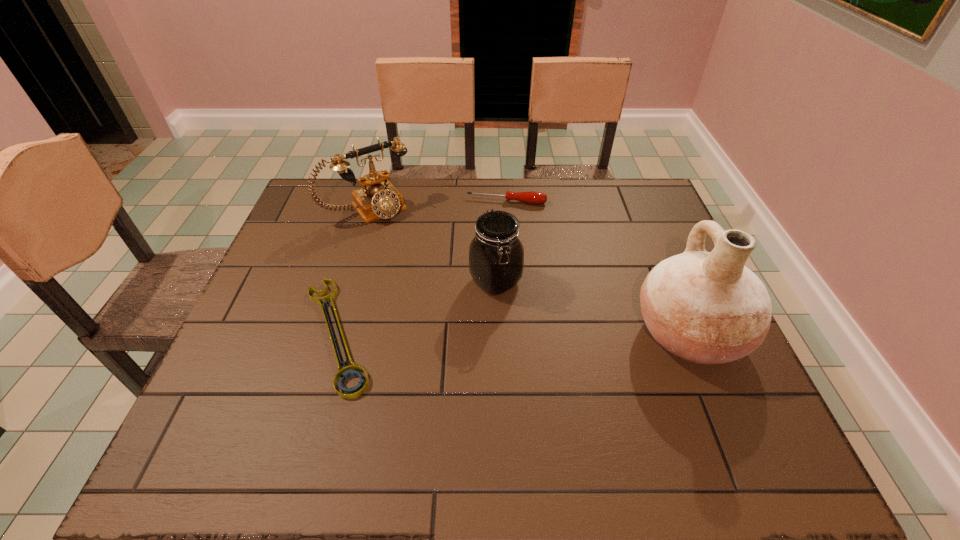
Find the location of a particular element. The height and width of the screenshot is (540, 960). wrench is located at coordinates (354, 370).

I want to click on the rightmost object, so click(x=708, y=308).

Where is `pottery`? pottery is located at coordinates (708, 308).

At what (x,y) coordinates should I click in order to perform the action: click on telephone. Please return your answer as a coordinate pair (x, y). Looking at the image, I should click on (378, 198).

Image resolution: width=960 pixels, height=540 pixels. What are the coordinates of `the second shortest object` in the screenshot? It's located at (532, 197).

Find the location of a particular element. This screenshot has width=960, height=540. jar is located at coordinates (496, 255).

At what (x,y) coordinates should I click in order to perform the action: click on free region located 0.290m on the back of the wrench. Please return your answer as a coordinate pair (x, y). The width and height of the screenshot is (960, 540). Looking at the image, I should click on [372, 215].

Image resolution: width=960 pixels, height=540 pixels. Identify the location of free space located on the dial number of the telephone. (433, 279).

The width and height of the screenshot is (960, 540). What are the coordinates of `vacant space located on the dial number of the telephone` in the screenshot? It's located at (396, 232).

Find the location of a particular element. Image resolution: width=960 pixels, height=540 pixels. free space located on the dial number of the telephone is located at coordinates tap(406, 246).